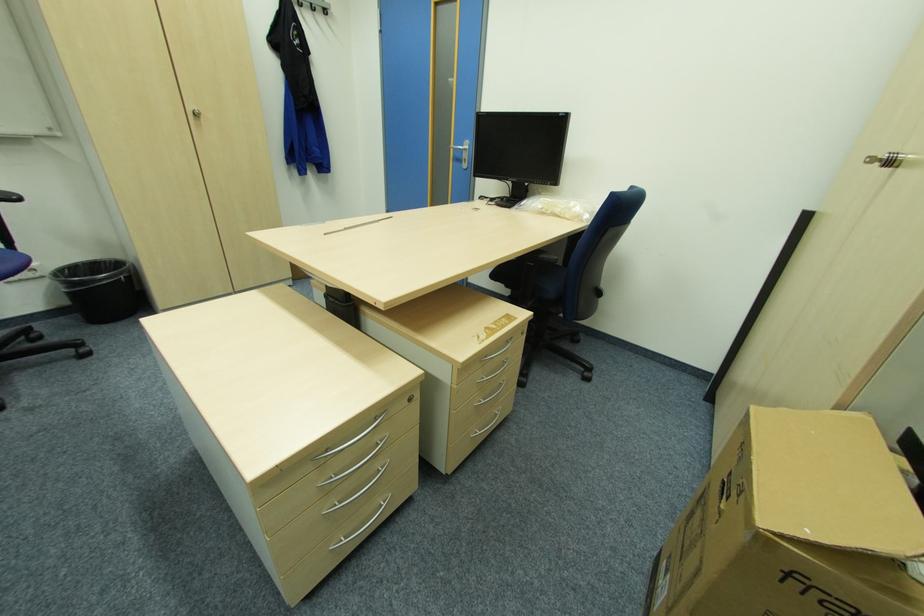
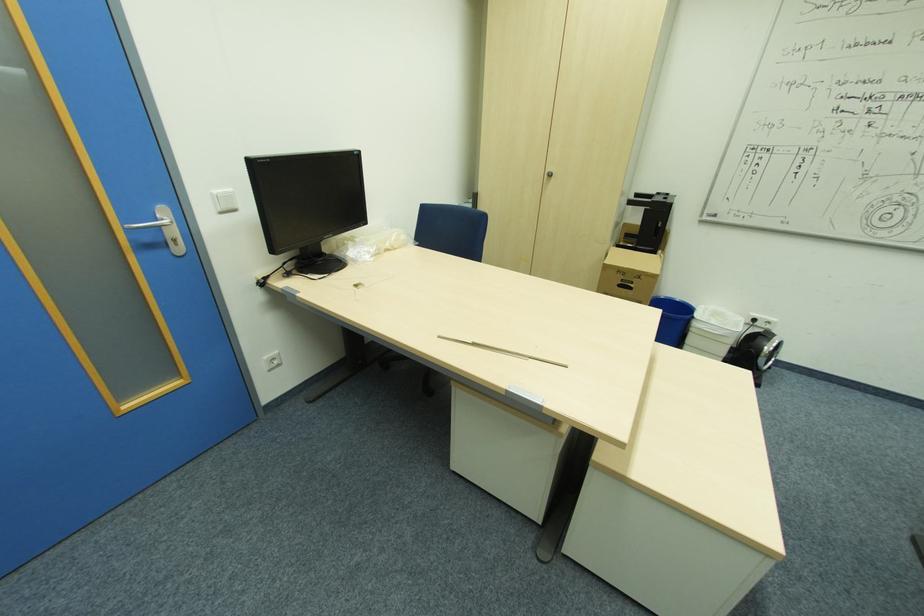
Locate, in the second image, the point that corresponds to (x=742, y=495) in the first image.

(641, 277)